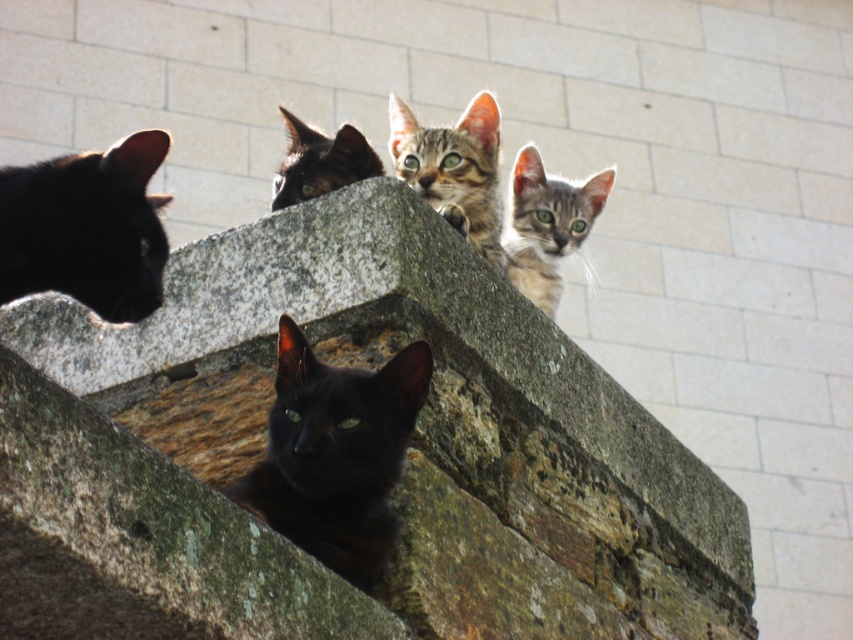
You are a photographer trying to capture a closeup of the shiny black cat at upper center without including the tabby fur kitten at upper right in the frame. Given their positions, can you position yourself in a way to achieve this?

The tabby fur kitten at upper right is positioned on the right side of the shiny black cat at upper center. To avoid including the tabby fur kitten at upper right, the photographer should position themselves to the right of the shiny black cat at upper center so that the tabby fur kitten at upper right is out of frame.

You are a photographer trying to capture a photo of the black glossy cat at center. The granite ledge at upper center is blocking your view. Can you determine if the ledge is tall enough to completely hide the cat from your camera angle?

The granite ledge at upper center is much taller than the black glossy cat at center, so it can completely hide the cat from your camera angle.